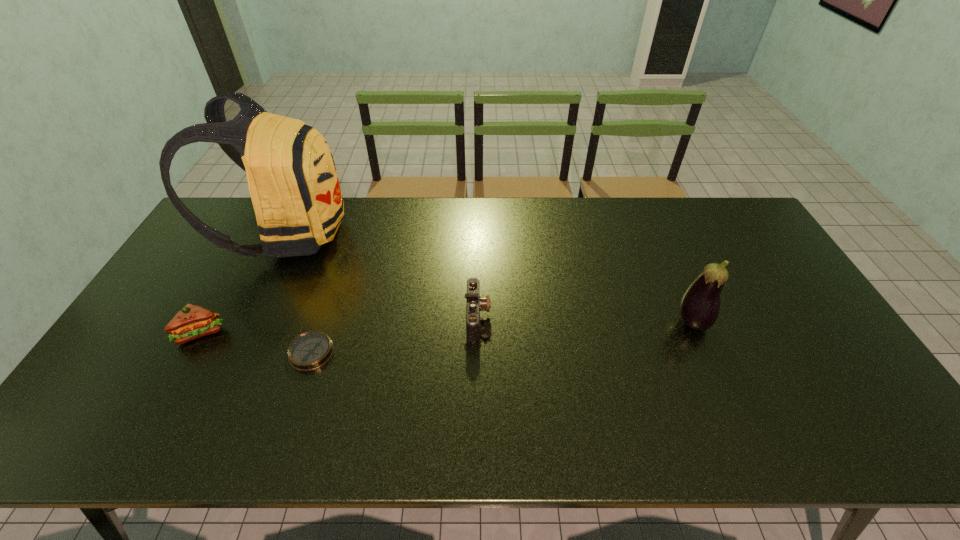
Where is `vacant space situated 0.280m on the front of the sandwich`? Image resolution: width=960 pixels, height=540 pixels. vacant space situated 0.280m on the front of the sandwich is located at coordinates (135, 451).

At what (x,y) coordinates should I click in order to perform the action: click on vacant space located 0.190m on the front-facing side of the camera. Please return your answer as a coordinate pair (x, y). Looking at the image, I should click on (558, 318).

Identify the location of free space located 0.220m on the right of the compass. [x=417, y=353].

Image resolution: width=960 pixels, height=540 pixels. What are the coordinates of `object positioned at the far edge` in the screenshot? It's located at (293, 183).

The image size is (960, 540). In order to click on backpack that is at the left edge in this screenshot , I will do `click(293, 183)`.

At what (x,y) coordinates should I click in order to perform the action: click on sandwich that is at the left edge. Please return your answer as a coordinate pair (x, y). The height and width of the screenshot is (540, 960). Looking at the image, I should click on (192, 321).

The height and width of the screenshot is (540, 960). What are the coordinates of `object that is at the far left corner` in the screenshot? It's located at (293, 183).

You are a GUI agent. You are given a task and a screenshot of the screen. Output one action in this format:
    pyautogui.click(x=<x>, y=<y>)
    Task: Click on the vacant space at the far edge
    
    Given the screenshot: What is the action you would take?
    pyautogui.click(x=434, y=206)

The image size is (960, 540). In order to click on vacant area at the near edge of the desktop in this screenshot , I will do `click(710, 426)`.

The image size is (960, 540). I want to click on vacant space at the right edge of the desktop, so click(x=802, y=370).